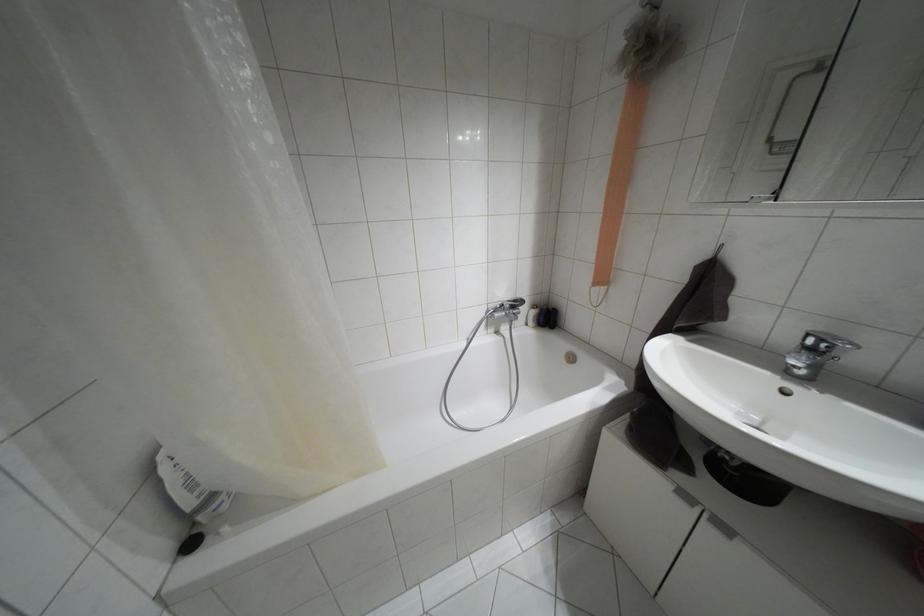
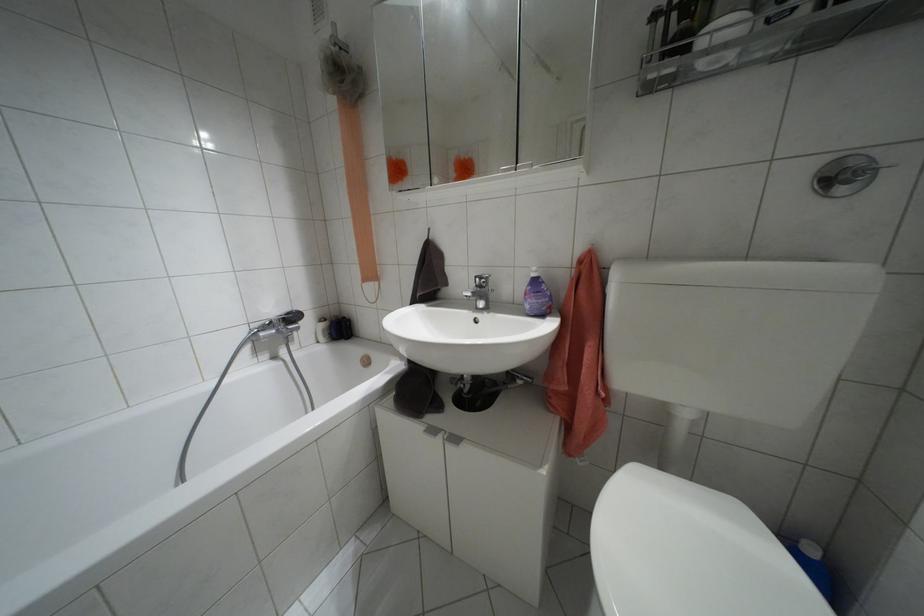
Locate, in the second image, the point that corresponds to pixel 811 350 in the first image.

(479, 286)